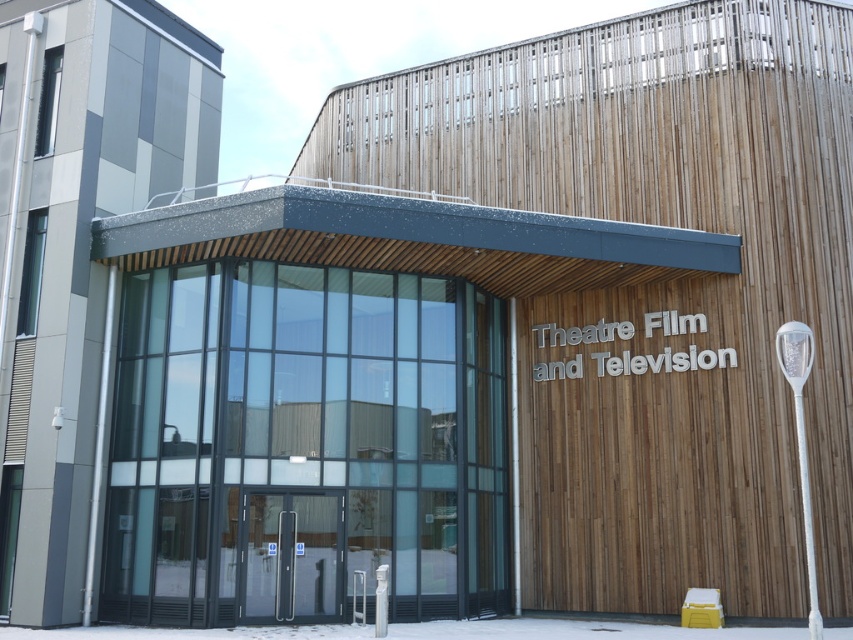
How distant is transparent glass doors at center from white powdery snow at lower center?

They are 1.59 meters apart.

Does transparent glass doors at center have a greater width compared to white powdery snow at lower center?

In fact, transparent glass doors at center might be narrower than white powdery snow at lower center.

The image size is (853, 640). What do you see at coordinates (291, 556) in the screenshot?
I see `transparent glass doors at center` at bounding box center [291, 556].

This screenshot has width=853, height=640. Identify the location of transparent glass doors at center. (291, 556).